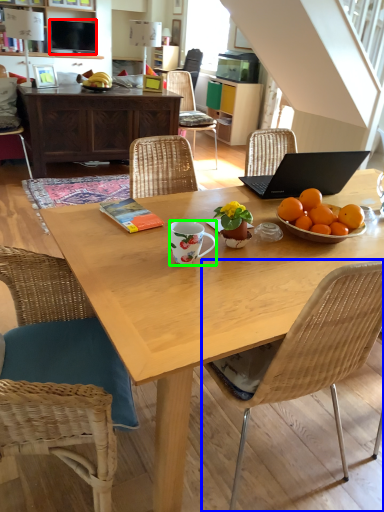
Question: Which object is the closest to the television (highlighted by a red box)? Choose among these: chair (highlighted by a blue box) or coffee cup (highlighted by a green box).

Choices:
 (A) chair
 (B) coffee cup

Answer: (B)